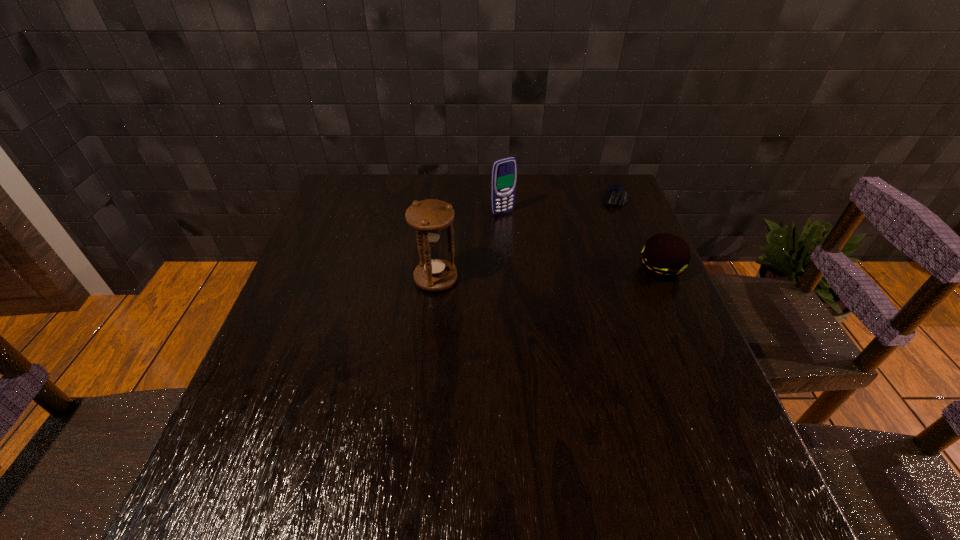
What are the coordinates of `free space in the image that satisfies the following two spatial constraints: 1. on the front side of the second shortest object; 2. on the left side of the cellular telephone` in the screenshot? It's located at (507, 269).

This screenshot has width=960, height=540. I want to click on free region that satisfies the following two spatial constraints: 1. on the back side of the third shortest object; 2. on the right side of the computer mouse, so click(x=502, y=198).